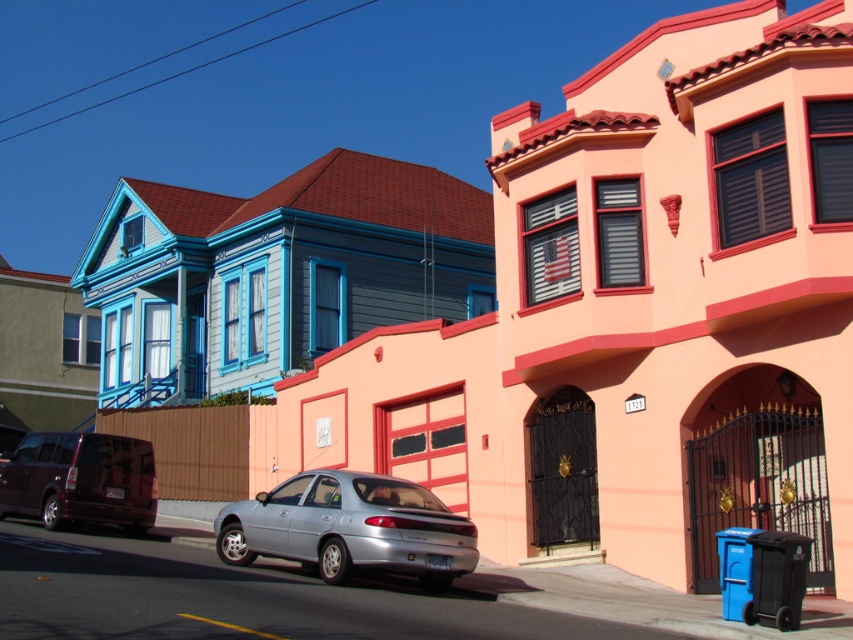
You are standing at the entrance of the house on the left. You want to park your car at the point marked as point (x=350, y=528). Is this point located in front of the house on the left or the house on the right?

The point (x=350, y=528) is where the silver metallic sedan at center is located. Since the sedan is at the center of the image, it is equidistant from both houses. Therefore, the point is not in front of either house specifically but is centrally positioned between them.

You are a delivery person trying to park your 1.8 meters tall delivery box in the space between the silver metallic sedan at center and the shiny dark purple van at lower left. Can the delivery box fit vertically between them?

The silver metallic sedan at center has a lesser height compared to shiny dark purple van at lower left. Since the delivery box is 1.8 meters tall, it can fit vertically between them as the height difference allows enough space.